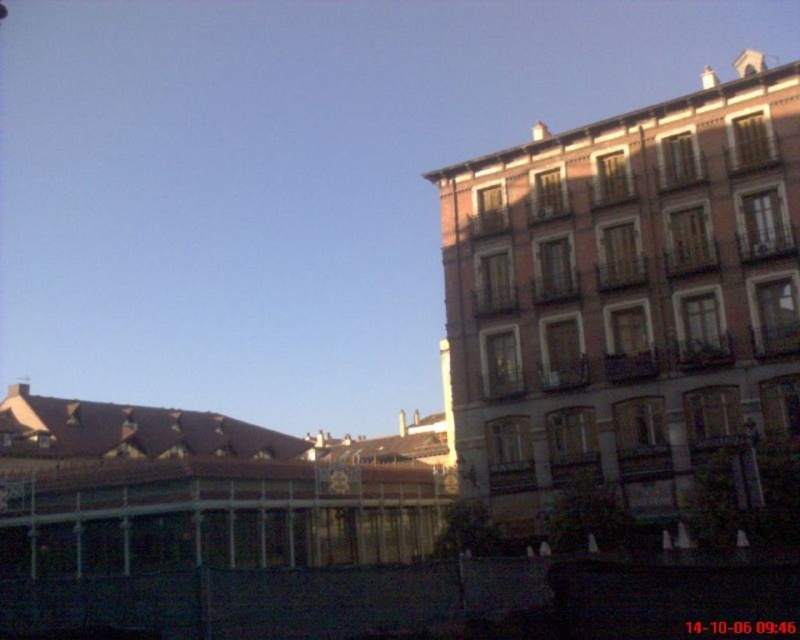
You are standing in the urban scene described. You need to locate the red brick building at right. What are its coordinates in the image?

The coordinates of the red brick building at right are at point (624, 298).